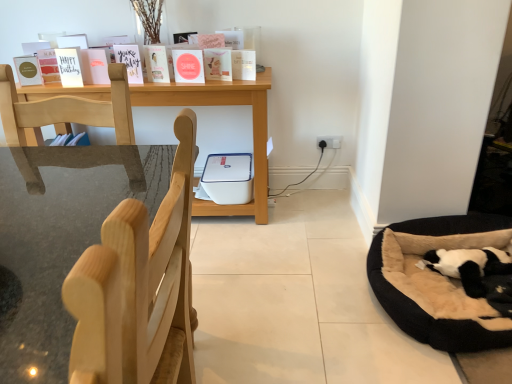
Question: Is light wood chair at left facing towards matte pink card at upper left, marked as the 3th paperback book in a left-to-right arrangement?

Choices:
 (A) no
 (B) yes

Answer: (A)

Question: Is light wood chair at left outside matte pink card at upper left, acting as the 6th paperback book starting from the right?

Choices:
 (A) no
 (B) yes

Answer: (B)

Question: Can you confirm if light wood chair at left is positioned to the right of matte pink card at upper left, acting as the 6th paperback book starting from the right?

Choices:
 (A) no
 (B) yes

Answer: (B)

Question: Is the position of light wood chair at left more distant than that of matte pink card at upper left, acting as the 6th paperback book starting from the right?

Choices:
 (A) no
 (B) yes

Answer: (A)

Question: Is light wood chair at left wider than matte pink card at upper left, marked as the 3th paperback book in a left-to-right arrangement?

Choices:
 (A) no
 (B) yes

Answer: (B)

Question: Is light wood chair at left next to matte pink card at upper left, acting as the 6th paperback book starting from the right, and touching it?

Choices:
 (A) no
 (B) yes

Answer: (A)

Question: Are matte pink card at upper left, marked as the 3th paperback book in a left-to-right arrangement, and matte white paperback book at center, which ranks as the 2th paperback book in right-to-left order, located far from each other?

Choices:
 (A) no
 (B) yes

Answer: (A)

Question: From a real-world perspective, is matte pink card at upper left, acting as the 6th paperback book starting from the right, positioned under matte white paperback book at center, which ranks as the seventh paperback book in left-to-right order, based on gravity?

Choices:
 (A) no
 (B) yes

Answer: (A)

Question: Could matte white paperback book at center, which ranks as the 2th paperback book in right-to-left order, be considered to be inside matte pink card at upper left, acting as the 6th paperback book starting from the right?

Choices:
 (A) no
 (B) yes

Answer: (A)

Question: From a real-world perspective, does matte pink card at upper left, acting as the 6th paperback book starting from the right, stand above matte white paperback book at center, which ranks as the seventh paperback book in left-to-right order?

Choices:
 (A) yes
 (B) no

Answer: (A)

Question: Is matte pink card at upper left, acting as the 6th paperback book starting from the right, placed right next to matte white paperback book at center, which ranks as the seventh paperback book in left-to-right order?

Choices:
 (A) no
 (B) yes

Answer: (A)

Question: Considering the relative sizes of matte pink card at upper left, marked as the 3th paperback book in a left-to-right arrangement, and matte white paperback book at center, which ranks as the 2th paperback book in right-to-left order, in the image provided, is matte pink card at upper left, marked as the 3th paperback book in a left-to-right arrangement, thinner than matte white paperback book at center, which ranks as the 2th paperback book in right-to-left order,?

Choices:
 (A) no
 (B) yes

Answer: (B)

Question: Can you confirm if white matte paperback book at upper center, positioned as the 8th paperback book in left-to-right order, is wider than black plush dog bed at lower right?

Choices:
 (A) yes
 (B) no

Answer: (B)